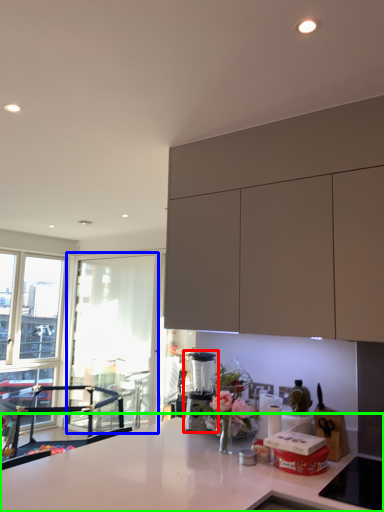
Question: Considering the real-world distances, which object is farthest from coffee machine (highlighted by a red box)? window screen (highlighted by a blue box) or countertop (highlighted by a green box)?

Choices:
 (A) window screen
 (B) countertop

Answer: (A)